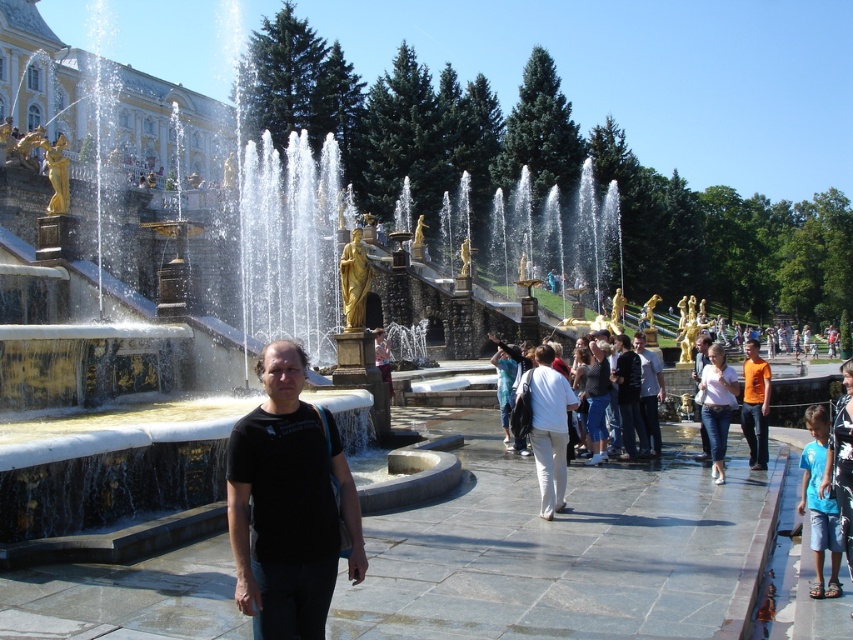
Question: Which of the following is the farthest from the observer?

Choices:
 (A) tap(821, 440)
 (B) tap(379, 353)
 (C) tap(267, 611)
 (D) tap(769, 390)

Answer: (B)

Question: Can you confirm if blue cotton shirt at lower right is positioned to the left of denim jeans at center?

Choices:
 (A) no
 (B) yes

Answer: (B)

Question: Does white cotton pants at center have a larger size compared to orange cotton t-shirt at center?

Choices:
 (A) yes
 (B) no

Answer: (B)

Question: Which of the following is the closest to the observer?

Choices:
 (A) (654, 401)
 (B) (766, 364)
 (C) (387, 378)

Answer: (B)

Question: Is black matte t-shirt at center wider than orange cotton t-shirt at center?

Choices:
 (A) no
 (B) yes

Answer: (A)

Question: Which object is positioned closest to the black matte t-shirt at center?

Choices:
 (A) black cotton shirt at center
 (B) white cotton pants at center

Answer: (B)